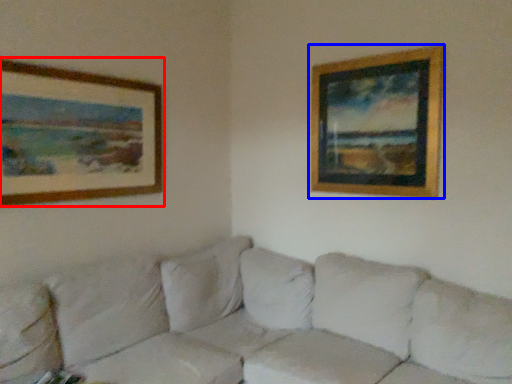
Question: Which of the following is the farthest to the observer, picture frame (highlighted by a red box) or picture frame (highlighted by a blue box)?

Choices:
 (A) picture frame
 (B) picture frame

Answer: (B)